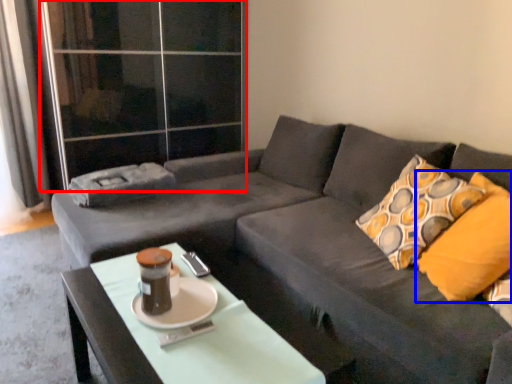
Question: Among these objects, which one is nearest to the camera, glass door (highlighted by a red box) or throw pillow (highlighted by a blue box)?

Choices:
 (A) glass door
 (B) throw pillow

Answer: (B)